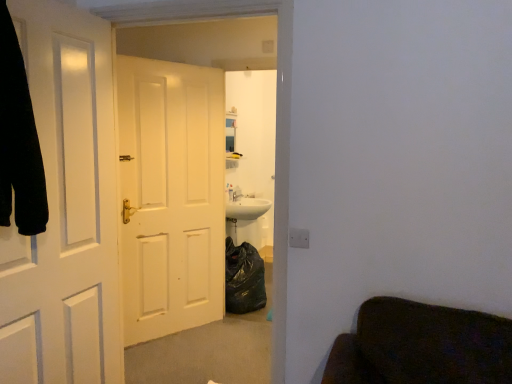
Question: Could white matte door at left, the 1th door positioned from the front, be considered to be inside white matte door at center, which is the 2th door in front-to-back order?

Choices:
 (A) yes
 (B) no

Answer: (B)

Question: Is white matte door at center, which is the 2th door in front-to-back order, next to white matte door at left, arranged as the 2th door when viewed from the back, and touching it?

Choices:
 (A) yes
 (B) no

Answer: (B)

Question: From the image's perspective, is white matte door at center, which is the 2th door in front-to-back order, located above white matte door at left, arranged as the 2th door when viewed from the back?

Choices:
 (A) yes
 (B) no

Answer: (A)

Question: Can you confirm if white matte door at center, which is the 2th door in front-to-back order, is shorter than white matte door at left, the 1th door positioned from the front?

Choices:
 (A) yes
 (B) no

Answer: (B)

Question: Are white matte door at center, positioned as the 1th door in back-to-front order, and white matte door at left, the 1th door positioned from the front, far apart?

Choices:
 (A) no
 (B) yes

Answer: (B)

Question: From a real-world perspective, is white matte door at center, positioned as the 1th door in back-to-front order, below white matte door at left, the 1th door positioned from the front?

Choices:
 (A) no
 (B) yes

Answer: (B)

Question: Is the depth of white matte door at left, the 1th door positioned from the front, greater than that of white matte door at center, which is the 2th door in front-to-back order?

Choices:
 (A) yes
 (B) no

Answer: (B)

Question: Does white matte door at left, arranged as the 2th door when viewed from the back, have a lesser height compared to white matte door at center, which is the 2th door in front-to-back order?

Choices:
 (A) yes
 (B) no

Answer: (A)

Question: Could you tell me if white matte door at left, arranged as the 2th door when viewed from the back, is facing white matte door at center, which is the 2th door in front-to-back order?

Choices:
 (A) no
 (B) yes

Answer: (A)

Question: Is white matte door at center, which is the 2th door in front-to-back order, completely or partially inside white matte door at left, arranged as the 2th door when viewed from the back?

Choices:
 (A) no
 (B) yes

Answer: (A)

Question: Is white matte door at left, arranged as the 2th door when viewed from the back, at the left side of white matte door at center, which is the 2th door in front-to-back order?

Choices:
 (A) no
 (B) yes

Answer: (B)

Question: From a real-world perspective, is white matte door at left, arranged as the 2th door when viewed from the back, located beneath white matte door at center, which is the 2th door in front-to-back order?

Choices:
 (A) yes
 (B) no

Answer: (B)

Question: Considering the relative sizes of black fabric robe at left and white matte door at left, the 1th door positioned from the front, in the image provided, is black fabric robe at left smaller than white matte door at left, the 1th door positioned from the front,?

Choices:
 (A) yes
 (B) no

Answer: (A)